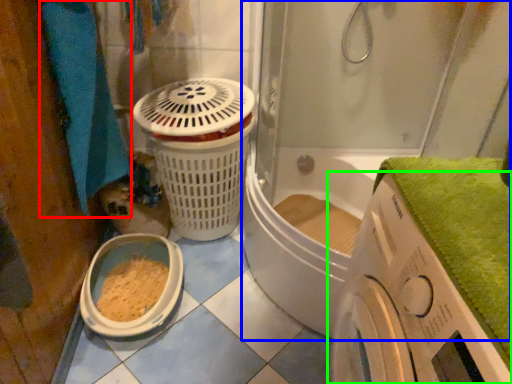
Question: Based on their relative distances, which object is nearer to bath towel (highlighted by a red box)? Choose from shower door (highlighted by a blue box) and washing machine (highlighted by a green box).

Choices:
 (A) shower door
 (B) washing machine

Answer: (A)